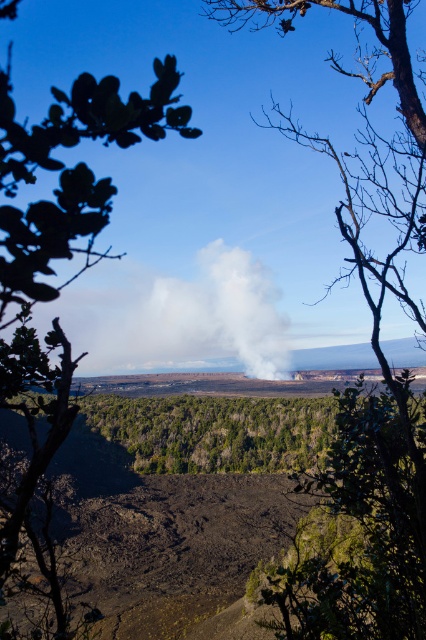
Between bare branches at center and green leafy tree at upper left, which one has more height?

Standing taller between the two is bare branches at center.

Does bare branches at center appear over green leafy tree at upper left?

Yes, bare branches at center is above green leafy tree at upper left.

Locate an element on the screen. Image resolution: width=426 pixels, height=640 pixels. bare branches at center is located at coordinates (377, 358).